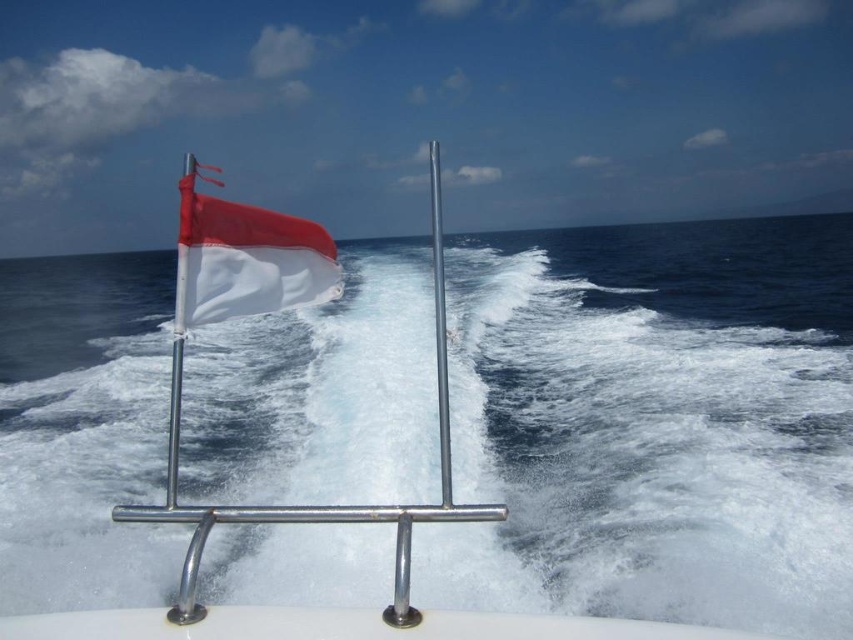
Does polished metal pole at center have a greater height compared to red/white flag at left?

Incorrect, polished metal pole at center's height is not larger of red/white flag at left's.

Can you confirm if polished metal pole at center is wider than red/white flag at left?

Incorrect, polished metal pole at center's width does not surpass red/white flag at left's.

This screenshot has height=640, width=853. Describe the element at coordinates (439, 324) in the screenshot. I see `polished metal pole at center` at that location.

Find the location of a particular element. The image size is (853, 640). polished metal pole at center is located at coordinates [439, 324].

Who is positioned more to the right, white matte flag at upper left or red/white flag at left?

Positioned to the right is white matte flag at upper left.

Looking at this image, who is lower down, white matte flag at upper left or red/white flag at left?

Positioned lower is red/white flag at left.

Between point (239, 266) and point (183, 305), which one is positioned in front?

Positioned in front is point (183, 305).

The width and height of the screenshot is (853, 640). I want to click on white matte flag at upper left, so click(x=247, y=259).

Is white matte flag at upper left taller than polished metal pole at center?

In fact, white matte flag at upper left may be shorter than polished metal pole at center.

Who is lower down, white matte flag at upper left or polished metal pole at center?

polished metal pole at center is below.

This screenshot has height=640, width=853. What are the coordinates of `white matte flag at upper left` in the screenshot? It's located at click(247, 259).